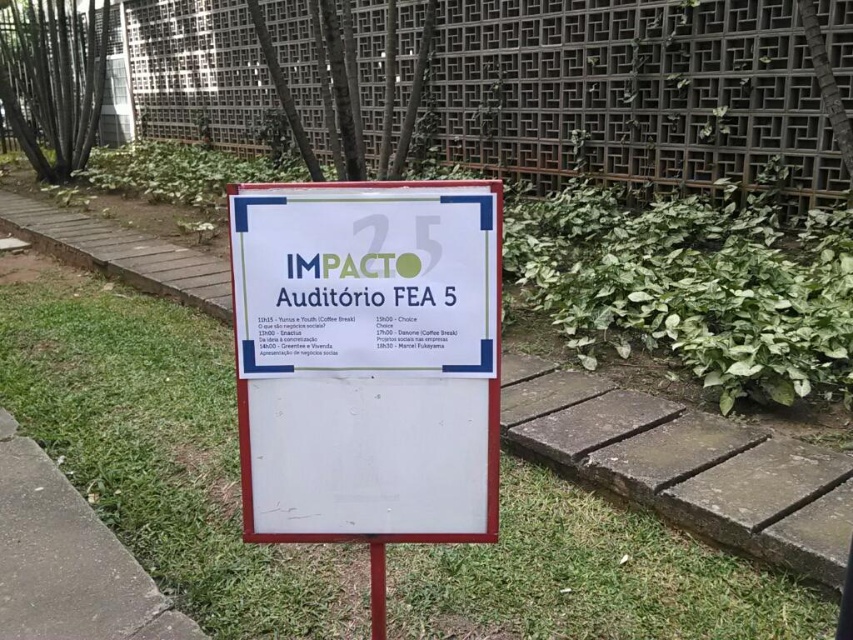
Does point (509, 598) come behind point (144, 605)?

Yes, it is behind point (144, 605).

Is green grass at center bigger than green grass at lower left?

Yes.

Does point (212, 496) lie behind point (67, 616)?

Yes, point (212, 496) is behind point (67, 616).

Find the location of a particular element. The width and height of the screenshot is (853, 640). green grass at center is located at coordinates (163, 452).

Is green grass at lower left further to camera compared to metallic red post at center?

That is True.

Consider the image. Which is above, green grass at lower left or metallic red post at center?

Positioned higher is green grass at lower left.

Between point (22, 461) and point (383, 588), which one is positioned behind?

The point (22, 461) is behind.

Locate an element on the screen. Image resolution: width=853 pixels, height=640 pixels. green grass at lower left is located at coordinates (67, 561).

Is green grass at center smaller than white paper sign at center?

No.

From the picture: Can you confirm if green grass at center is bigger than white paper sign at center?

Correct, green grass at center is larger in size than white paper sign at center.

Measure the distance between green grass at center and camera.

A distance of 6.06 feet exists between green grass at center and camera.

The width and height of the screenshot is (853, 640). In order to click on green grass at center in this screenshot , I will do `click(163, 452)`.